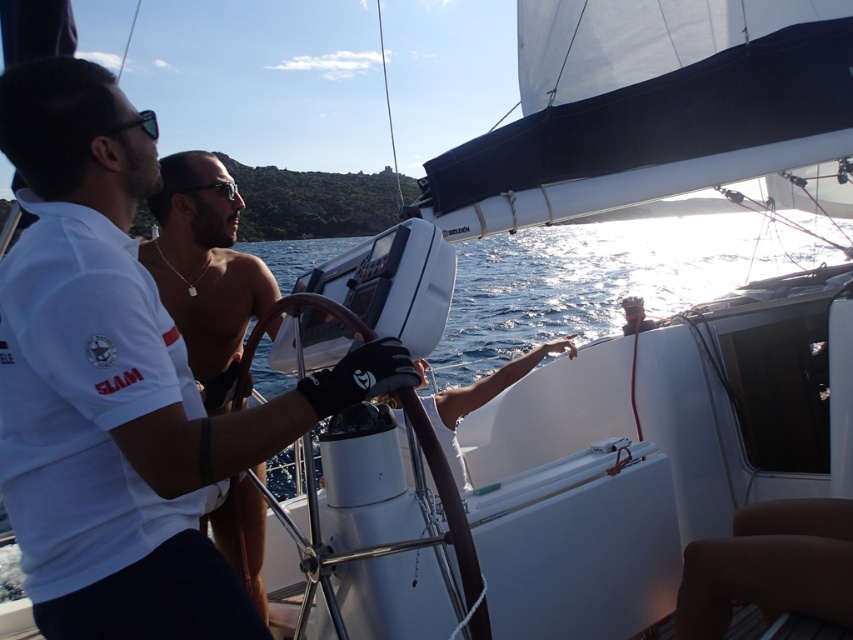
Question: Which is farther from the shiny black sunglasses at center?

Choices:
 (A) black plastic goggles at center
 (B) white matte shirt at center

Answer: (B)

Question: Can you confirm if white matte shirt at center is positioned to the right of black plastic goggles at center?

Choices:
 (A) no
 (B) yes

Answer: (B)

Question: Which point is farther from the camera taking this photo?

Choices:
 (A) (219, 552)
 (B) (311, 426)
 (C) (184, 188)

Answer: (C)

Question: Is white matte shirt at center to the left of black plastic goggles at center from the viewer's perspective?

Choices:
 (A) yes
 (B) no

Answer: (B)

Question: Can you confirm if shiny black sunglasses at center is bigger than black plastic goggles at center?

Choices:
 (A) no
 (B) yes

Answer: (B)

Question: Which point is closer to the camera?

Choices:
 (A) black plastic goggles at center
 (B) white matte shirt at center

Answer: (B)